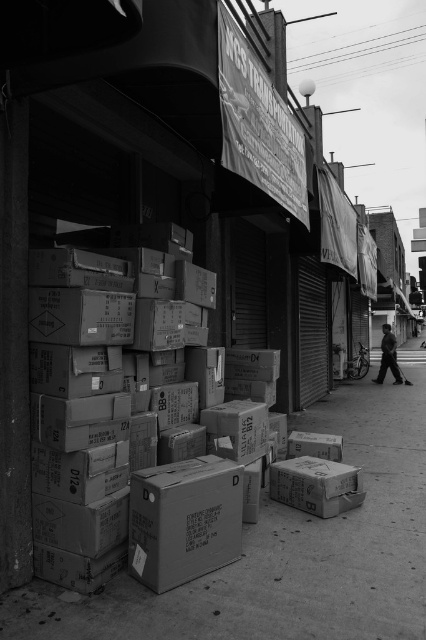
Question: Is matte cardboard boxes at lower center smaller than dark gray suit at right?

Choices:
 (A) yes
 (B) no

Answer: (A)

Question: Is matte cardboard boxes at lower center below dark gray suit at right?

Choices:
 (A) yes
 (B) no

Answer: (A)

Question: Is matte cardboard boxes at lower center smaller than dark gray suit at right?

Choices:
 (A) yes
 (B) no

Answer: (A)

Question: Which point is closer to the camera?

Choices:
 (A) matte cardboard boxes at lower center
 (B) dark gray suit at right

Answer: (A)